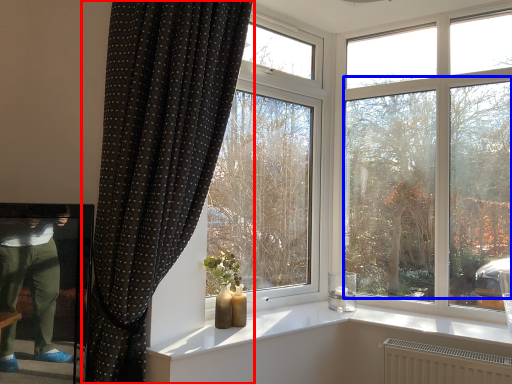
Question: Which point is closer to the camera, curtain (highlighted by a red box) or tree (highlighted by a blue box)?

Choices:
 (A) curtain
 (B) tree

Answer: (A)